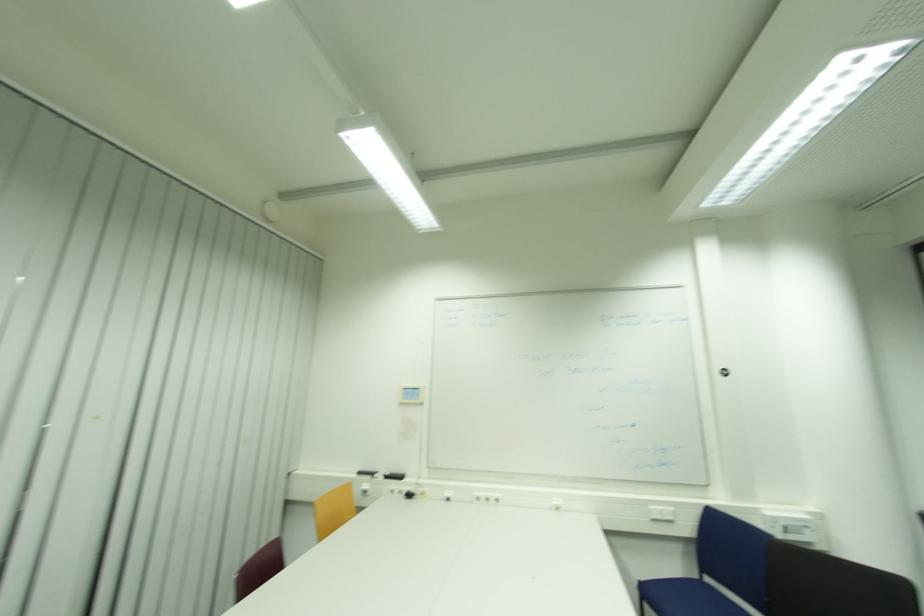
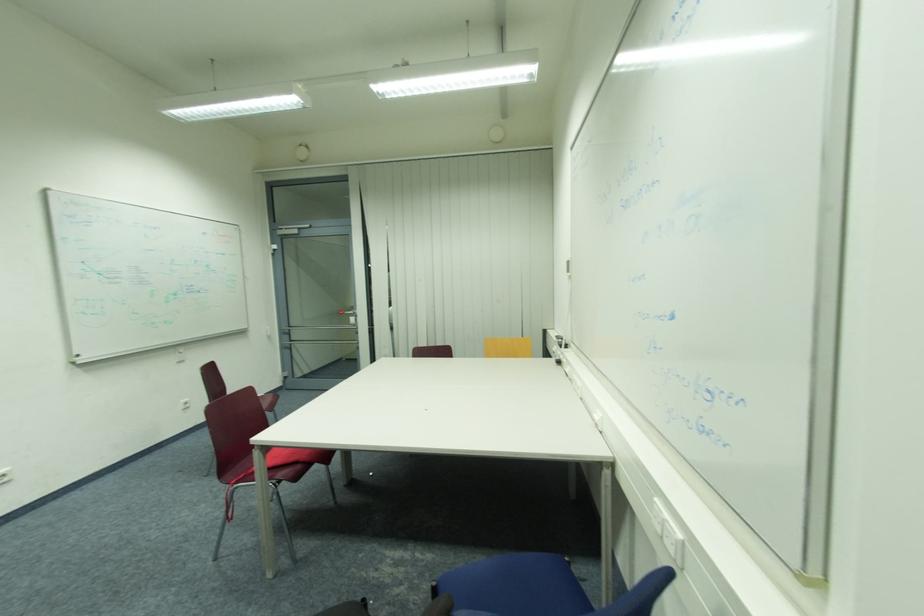
In the second image, find the point that corresponds to the point at 423,477 in the first image.

(578, 352)